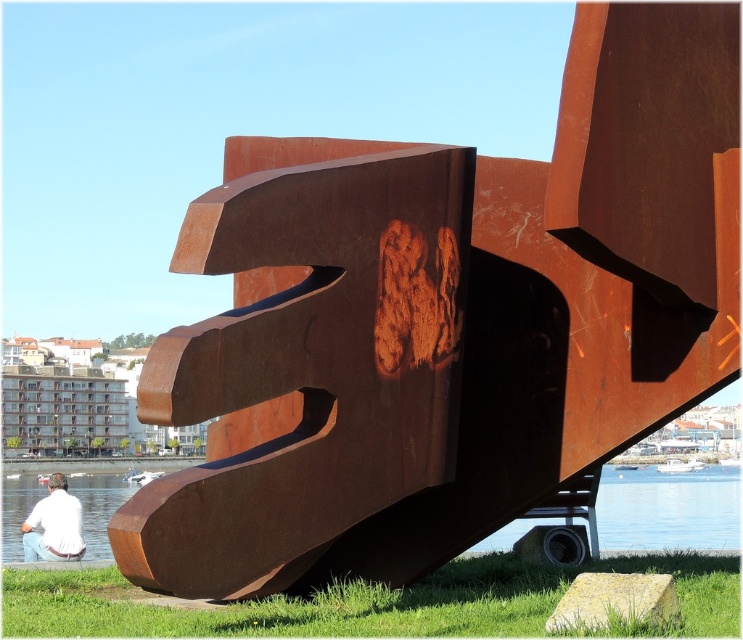
You are standing at the point marked by the coordinates point (x=366, y=602) in the image. What is the color of the ground beneath your feet?

The point (x=366, y=602) indicates green grass at lower center, so the ground beneath your feet is green grass.

You are standing in the scene and see the green grass at lower center and the white shirt at lower left. Which object is located to the right of the other?

The green grass at lower center is positioned on the right side of white shirt at lower left.

You are standing at the center of the image. Which direction should you move to reach the green grass at lower center?

The green grass at lower center is located at point (366, 602) in 2D coordinates, so you should move downward and slightly to the right to reach it.